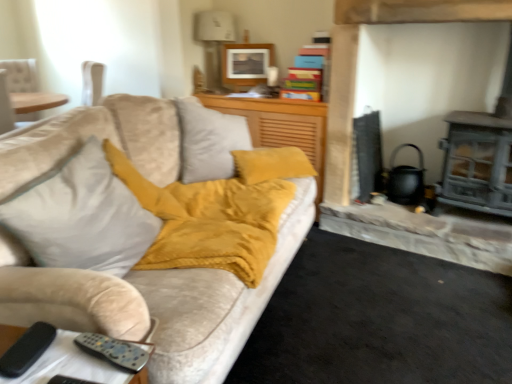
Question: Considering the relative sizes of matte wooden picture frame at upper center and matte gray fireplace at right in the image provided, is matte wooden picture frame at upper center thinner than matte gray fireplace at right?

Choices:
 (A) no
 (B) yes

Answer: (B)

Question: Does matte wooden picture frame at upper center have a greater height compared to matte gray fireplace at right?

Choices:
 (A) yes
 (B) no

Answer: (B)

Question: From a real-world perspective, is matte wooden picture frame at upper center positioned over matte gray fireplace at right based on gravity?

Choices:
 (A) no
 (B) yes

Answer: (B)

Question: Is matte wooden picture frame at upper center positioned in front of matte gray fireplace at right?

Choices:
 (A) no
 (B) yes

Answer: (A)

Question: From a real-world perspective, is matte wooden picture frame at upper center located beneath matte gray fireplace at right?

Choices:
 (A) yes
 (B) no

Answer: (B)

Question: Considering the relative positions of matte wooden picture frame at upper center and matte gray fireplace at right in the image provided, is matte wooden picture frame at upper center behind matte gray fireplace at right?

Choices:
 (A) no
 (B) yes

Answer: (B)

Question: From the image's perspective, is matte wooden picture frame at upper center under suede-like mustard yellow cushion at center?

Choices:
 (A) yes
 (B) no

Answer: (B)

Question: Can you confirm if matte wooden picture frame at upper center is thinner than suede-like mustard yellow cushion at center?

Choices:
 (A) yes
 (B) no

Answer: (A)

Question: Can you confirm if matte wooden picture frame at upper center is shorter than suede-like mustard yellow cushion at center?

Choices:
 (A) yes
 (B) no

Answer: (A)

Question: From a real-world perspective, is matte wooden picture frame at upper center physically above suede-like mustard yellow cushion at center?

Choices:
 (A) no
 (B) yes

Answer: (B)

Question: Is matte wooden picture frame at upper center at the right side of suede-like mustard yellow cushion at center?

Choices:
 (A) no
 (B) yes

Answer: (A)

Question: Is matte wooden picture frame at upper center outside suede-like mustard yellow cushion at center?

Choices:
 (A) yes
 (B) no

Answer: (A)

Question: Is suede-like mustard yellow cushion at center taller than matte gray fireplace at right?

Choices:
 (A) yes
 (B) no

Answer: (B)